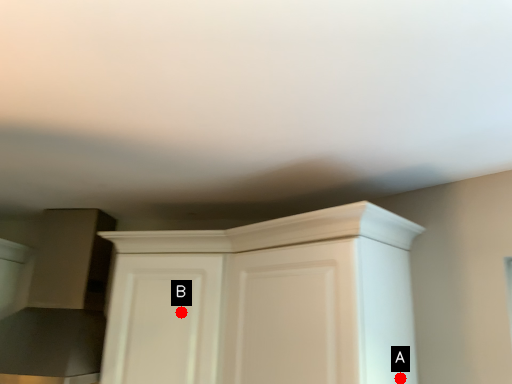
Question: Two points are circled on the image, labeled by A and B beside each circle. Which point is closer to the camera?

Choices:
 (A) A is closer
 (B) B is closer

Answer: (A)